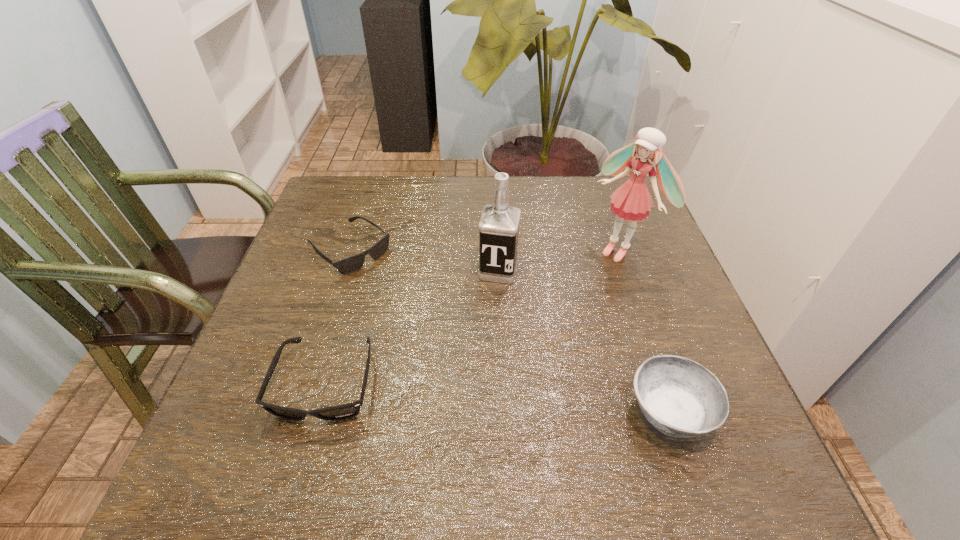
This screenshot has width=960, height=540. What are the coordinates of `vacant space on the desktop that is between the fourth tallest object and the ashtray and is positioned on the front-facing side of the doll` in the screenshot? It's located at pos(444,394).

Where is `vacant space on the desktop that is between the fourth tallest object and the ashtray and is positioned on the front label of the vodka`? This screenshot has height=540, width=960. vacant space on the desktop that is between the fourth tallest object and the ashtray and is positioned on the front label of the vodka is located at coordinates (468, 396).

The width and height of the screenshot is (960, 540). I want to click on vacant space on the desktop that is between the second shortest object and the ashtray and is positioned on the front-facing side of the shortest object, so click(534, 401).